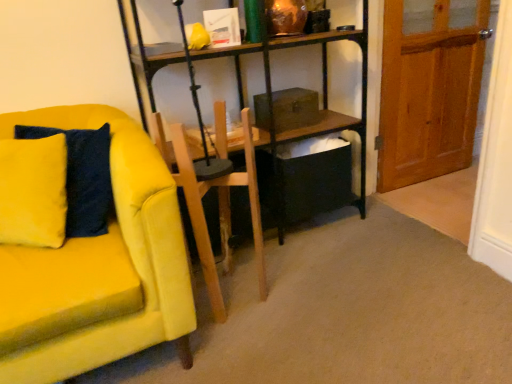
Where is `vacant space in front of wooden armchair at center`? The height and width of the screenshot is (384, 512). vacant space in front of wooden armchair at center is located at coordinates [x=237, y=340].